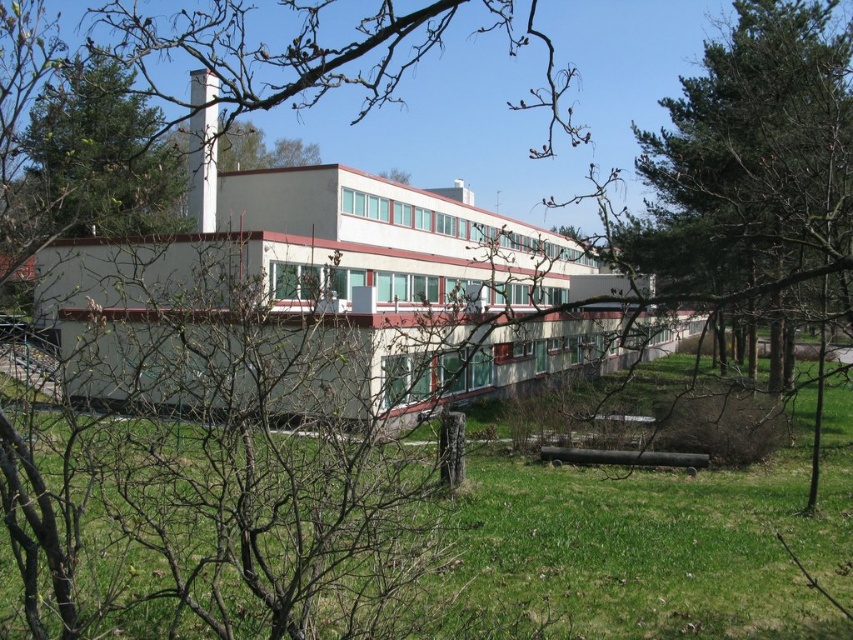
Looking at this image, between green leafy tree at upper left and white smooth chimney at upper center, which one is positioned higher?

white smooth chimney at upper center is higher up.

Does green leafy tree at upper left appear over white smooth chimney at upper center?

Actually, green leafy tree at upper left is below white smooth chimney at upper center.

Who is more forward, (74,125) or (207,138)?

Point (74,125)

Identify the location of green leafy tree at upper left. (96, 157).